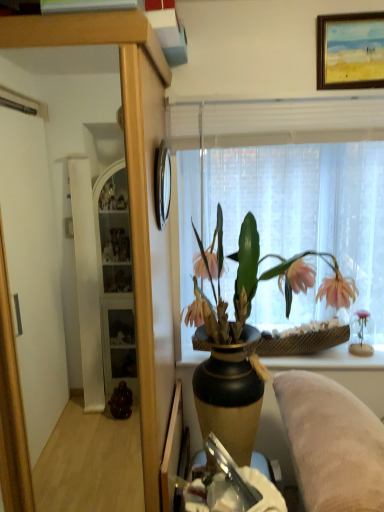
Question: Considering the positions of point 284,351 and point 329,18, is point 284,351 closer or farther from the camera than point 329,18?

Choices:
 (A) farther
 (B) closer

Answer: (A)

Question: Is woven brown basket at right wider or thinner than wooden-framed painting at upper center, the second picture frame when ordered from bottom to top?

Choices:
 (A) wide
 (B) thin

Answer: (A)

Question: Estimate the real-world distances between objects in this image. Which object is farther from the wooden clock at upper center, the 1th picture frame in the bottom-to-top sequence?

Choices:
 (A) woven brown basket at right
 (B) wooden cabinet at center
 (C) matte black vase with pink flowers at center
 (D) wooden-framed painting at upper center, the 2th picture frame viewed from the left
 (E) translucent fabric at upper center

Answer: (A)

Question: Which is nearer to the wooden clock at upper center, which is the 2th picture frame from top to bottom?

Choices:
 (A) matte black vase with pink flowers at center
 (B) wooden-framed painting at upper center, the second picture frame when ordered from bottom to top
 (C) translucent fabric at upper center
 (D) woven brown basket at right
 (E) wooden cabinet at center

Answer: (E)